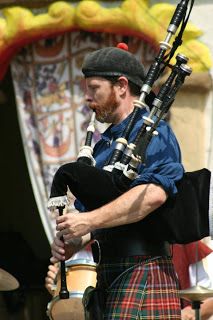
Identify the location of art. The image size is (213, 320). (60, 104).